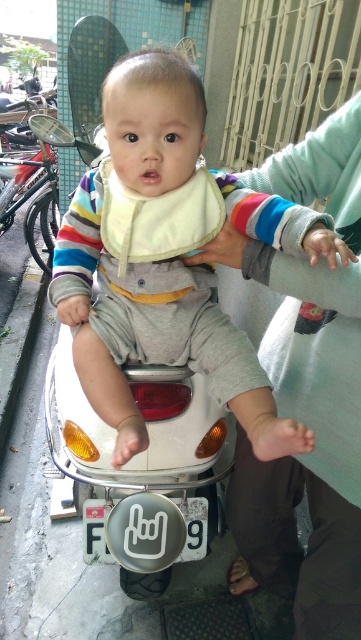
Question: Among these objects, which one is farthest from the camera?

Choices:
 (A) light green fabric at upper center
 (B) matte yellow bib at center

Answer: (A)

Question: Observing the image, what is the correct spatial positioning of matte yellow bib at center in reference to light green fabric at upper center?

Choices:
 (A) below
 (B) above

Answer: (B)

Question: Which of the following is the farthest from the observer?

Choices:
 (A) light green fabric at upper center
 (B) matte yellow bib at center

Answer: (A)

Question: Is matte yellow bib at center positioned in front of light green fabric at upper center?

Choices:
 (A) yes
 (B) no

Answer: (A)

Question: Can you confirm if matte yellow bib at center is positioned below light green fabric at upper center?

Choices:
 (A) yes
 (B) no

Answer: (B)